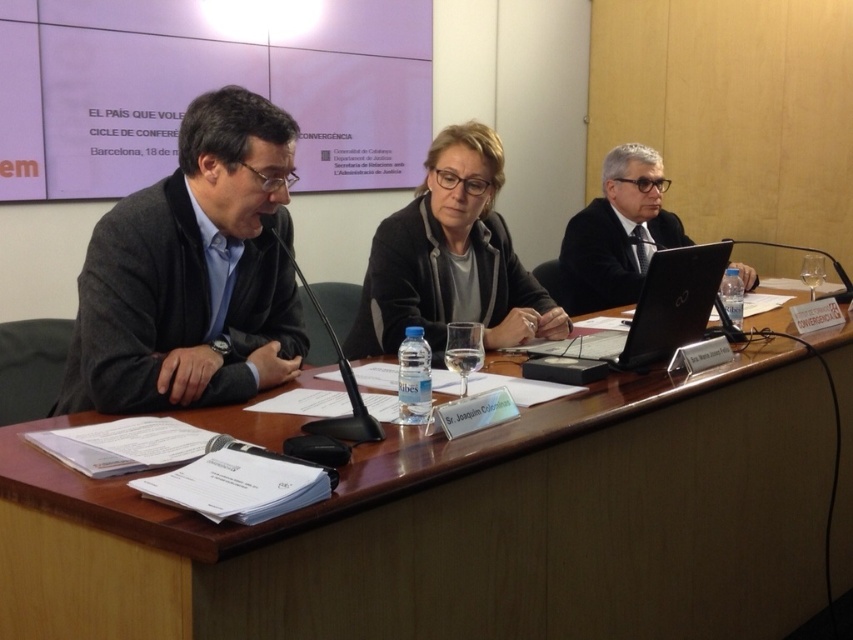
In the scene shown: Can you confirm if wooden at left is shorter than matte black suit at left?

In fact, wooden at left may be taller than matte black suit at left.

Is wooden at left closer to camera compared to matte black suit at left?

Yes, wooden at left is in front of matte black suit at left.

Does point (730, 516) come in front of point (293, 323)?

No.

Locate an element on the screen. wooden at left is located at coordinates (467, 528).

Who is more forward, [223,148] or [635,337]?

Point [223,148] is in front.

Does matte black suit at left have a greater height compared to black plastic laptop at center?

Indeed, matte black suit at left has a greater height compared to black plastic laptop at center.

The height and width of the screenshot is (640, 853). What are the coordinates of `matte black suit at left` in the screenshot? It's located at (193, 273).

Is wooden at left behind matte black jacket at center?

No, it is in front of matte black jacket at center.

Is wooden at left wider than matte black jacket at center?

Yes.

Image resolution: width=853 pixels, height=640 pixels. Find the location of `wooden at left`. wooden at left is located at coordinates (467, 528).